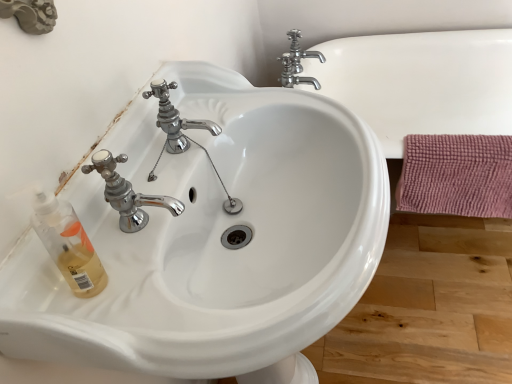
Question: Would you say polished chrome faucet at upper center, which is the 2th tap in right-to-left order, is outside pink textured bath towel at right?

Choices:
 (A) yes
 (B) no

Answer: (A)

Question: From a real-world perspective, is polished chrome faucet at upper center, marked as the first tap in a bottom-to-top arrangement, physically below pink textured bath towel at right?

Choices:
 (A) no
 (B) yes

Answer: (A)

Question: Considering the relative sizes of polished chrome faucet at upper center, which is the 1th tap in front-to-back order, and pink textured bath towel at right in the image provided, is polished chrome faucet at upper center, which is the 1th tap in front-to-back order, taller than pink textured bath towel at right?

Choices:
 (A) yes
 (B) no

Answer: (B)

Question: Is polished chrome faucet at upper center, which is the first tap in left-to-right order, closer to the viewer compared to pink textured bath towel at right?

Choices:
 (A) yes
 (B) no

Answer: (A)

Question: From the image's perspective, is polished chrome faucet at upper center, which is the 1th tap in front-to-back order, on pink textured bath towel at right?

Choices:
 (A) no
 (B) yes

Answer: (B)

Question: In the image, is polished chrome faucet at upper center, which is the 1th tap in front-to-back order, on the left side or the right side of chrome metallic faucet at upper center, marked as the first tap in a top-to-bottom arrangement?

Choices:
 (A) left
 (B) right

Answer: (A)

Question: From a real-world perspective, is polished chrome faucet at upper center, which is the first tap in left-to-right order, positioned above or below chrome metallic faucet at upper center, marked as the first tap in a top-to-bottom arrangement?

Choices:
 (A) below
 (B) above

Answer: (B)

Question: Is polished chrome faucet at upper center, which is the 1th tap in front-to-back order, situated inside chrome metallic faucet at upper center, positioned as the second tap in left-to-right order, or outside?

Choices:
 (A) outside
 (B) inside

Answer: (A)

Question: Is polished chrome faucet at upper center, marked as the first tap in a bottom-to-top arrangement, taller or shorter than chrome metallic faucet at upper center, marked as the first tap in a top-to-bottom arrangement?

Choices:
 (A) short
 (B) tall

Answer: (B)

Question: From their relative heights in the image, would you say polished chrome faucet at upper center, which is the 1th tap in front-to-back order, is taller or shorter than pink textured bath towel at right?

Choices:
 (A) tall
 (B) short

Answer: (B)

Question: Considering the positions of polished chrome faucet at upper center, which is the 2th tap in right-to-left order, and pink textured bath towel at right in the image, is polished chrome faucet at upper center, which is the 2th tap in right-to-left order, wider or thinner than pink textured bath towel at right?

Choices:
 (A) wide
 (B) thin

Answer: (A)

Question: From the image's perspective, is polished chrome faucet at upper center, the 2th tap from the back, positioned above or below pink textured bath towel at right?

Choices:
 (A) below
 (B) above

Answer: (B)

Question: Relative to pink textured bath towel at right, is polished chrome faucet at upper center, marked as the first tap in a bottom-to-top arrangement, in front or behind?

Choices:
 (A) behind
 (B) front

Answer: (B)

Question: Considering the positions of point (212, 190) and point (159, 125), is point (212, 190) closer or farther from the camera than point (159, 125)?

Choices:
 (A) farther
 (B) closer

Answer: (A)

Question: In terms of width, does white glossy sink at center look wider or thinner when compared to polished chrome faucet at upper center, which is the 1th tap in front-to-back order?

Choices:
 (A) wide
 (B) thin

Answer: (A)